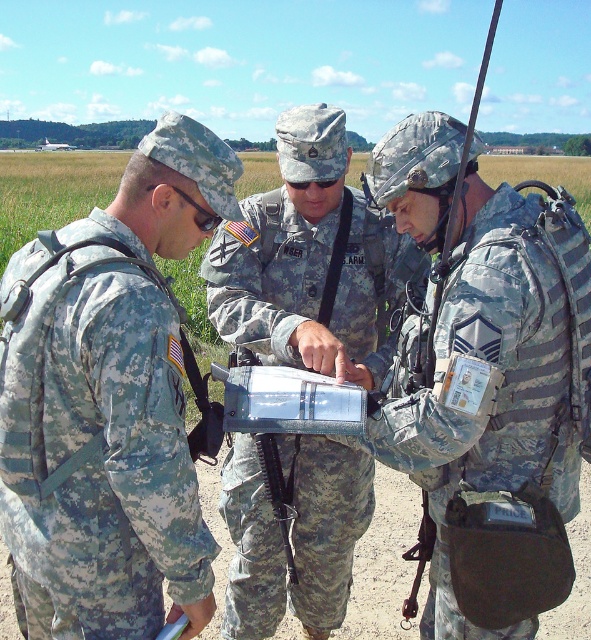
Question: Which point appears closest to the camera in this image?

Choices:
 (A) (431, 428)
 (B) (5, 285)

Answer: (B)

Question: Does camouflage fabric uniform at left appear over camouflage fabric uniform at center?

Choices:
 (A) yes
 (B) no

Answer: (B)

Question: Which is nearer to the camouflage fabric backpack at right?

Choices:
 (A) camouflage fabric uniform at left
 (B) camouflage fabric uniform at center

Answer: (B)

Question: Observing the image, what is the correct spatial positioning of camouflage fabric uniform at left in reference to camouflage fabric uniform at center?

Choices:
 (A) below
 (B) above

Answer: (A)

Question: Is camouflage fabric uniform at left behind camouflage fabric uniform at center?

Choices:
 (A) no
 (B) yes

Answer: (A)

Question: Which object is farther from the camera taking this photo?

Choices:
 (A) camouflage fabric backpack at right
 (B) camouflage fabric uniform at left
 (C) camouflage fabric uniform at center

Answer: (C)